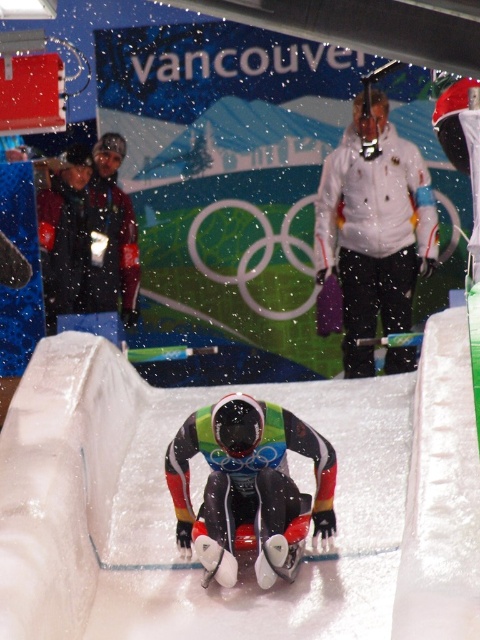
Question: Can you confirm if white matte jacket at upper center is bigger than multicolored glossy suit at center?

Choices:
 (A) yes
 (B) no

Answer: (A)

Question: Can you confirm if white matte jacket at upper center is positioned to the right of multicolored glossy suit at center?

Choices:
 (A) yes
 (B) no

Answer: (A)

Question: Among these points, which one is nearest to the camera?

Choices:
 (A) (244, 464)
 (B) (354, 209)

Answer: (A)

Question: Which point is closer to the camera taking this photo?

Choices:
 (A) (230, 449)
 (B) (357, 170)

Answer: (A)

Question: Is white matte jacket at upper center above multicolored glossy suit at center?

Choices:
 (A) yes
 (B) no

Answer: (A)